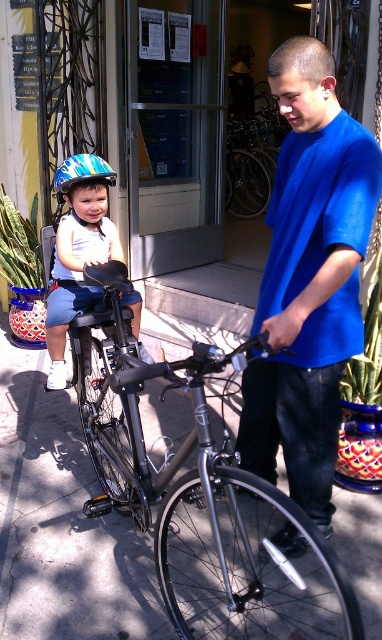
Question: Can you confirm if blue matte shirt at center is smaller than blue and green striped bicycle helmet at left?

Choices:
 (A) no
 (B) yes

Answer: (A)

Question: Can you confirm if shiny metallic bicycle at center is positioned to the left of blue matte shirt at center?

Choices:
 (A) no
 (B) yes

Answer: (B)

Question: Among these points, which one is nearest to the camera?

Choices:
 (A) (150, 356)
 (B) (93, 163)
 (C) (328, 224)
 (D) (270, 502)

Answer: (C)

Question: Which object is farther from the camera taking this photo?

Choices:
 (A) blue and green striped bicycle helmet at left
 (B) blue matte shirt at center
 (C) shiny metallic bicycle at center

Answer: (A)

Question: Which of these objects is positioned farthest from the blue matte shirt at center?

Choices:
 (A) shiny metallic bicycle at center
 (B) blue and green striped bicycle helmet at left
 (C) matte blue helmet at left

Answer: (B)

Question: Can you confirm if shiny metallic bicycle at center is wider than blue and green striped bicycle helmet at left?

Choices:
 (A) no
 (B) yes

Answer: (B)